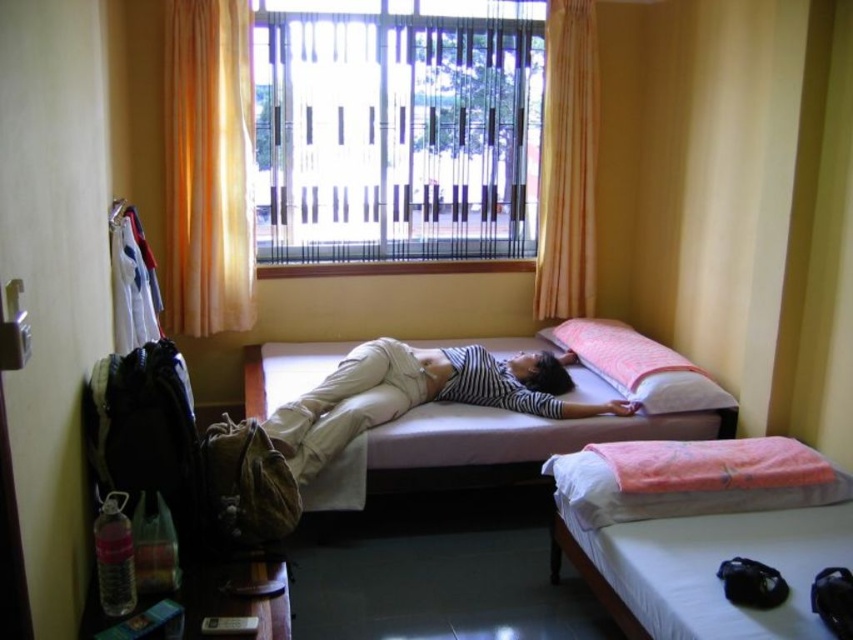
You are a delivery person who needs to place a new mattress in the room. The current mattress at center is at coordinates point 0.678, 0.563. Can you place the new mattress at the same coordinates without overlapping?

The mattress at center is already located at point (479, 433), so placing another mattress at the same coordinates would cause an overlap. You need to choose a different location.

You are standing in the room and want to place a small plant on the bed where the person is lying. The plant needs to be placed closer to the camera. Which point should you choose between point (x=711, y=531) and point (x=695, y=493)?

You should choose point (x=711, y=531) because it is closer to the camera than point (x=695, y=493).

You are standing in the room and want to look outside through the transparent plastic window at center. Is the orange fabric curtain at upper center blocking your view?

The transparent plastic window at center is positioned over orange fabric curtain at upper center, so the orange fabric curtain at upper center is behind the window and does not block the view.